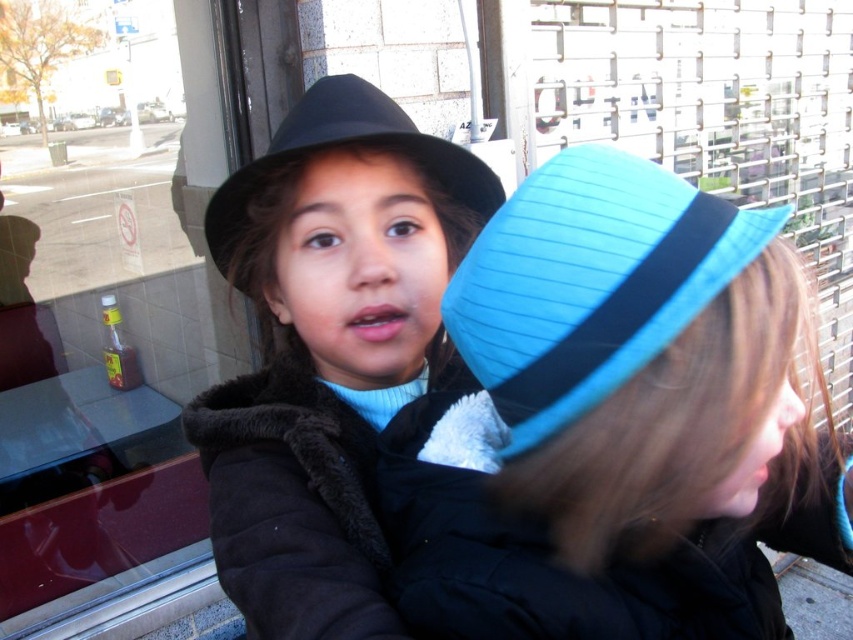
Question: Is blue felt hat at upper center above blue fabric hat at upper right?

Choices:
 (A) yes
 (B) no

Answer: (B)

Question: Among these points, which one is nearest to the camera?

Choices:
 (A) (25, 148)
 (B) (233, 387)
 (C) (450, 141)

Answer: (B)

Question: Can you confirm if blue felt hat at upper center is wider than matte black fedora at center?

Choices:
 (A) no
 (B) yes

Answer: (B)

Question: Considering the real-world distances, which object is closest to the matte black hat at center?

Choices:
 (A) matte black fedora at center
 (B) blue fabric hat at upper right

Answer: (A)

Question: Estimate the real-world distances between objects in this image. Which object is closer to the glass window at center?

Choices:
 (A) matte black fedora at center
 (B) blue felt hat at upper center
 (C) blue fabric hat at upper right
 (D) matte black hat at center

Answer: (D)

Question: Can you confirm if glass window at center is positioned below matte black hat at center?

Choices:
 (A) yes
 (B) no

Answer: (B)